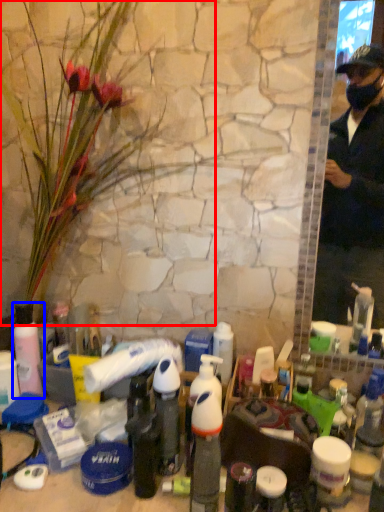
Question: Which of the following is the farthest to the observer, flower (highlighted by a red box) or bottle (highlighted by a blue box)?

Choices:
 (A) flower
 (B) bottle

Answer: (B)